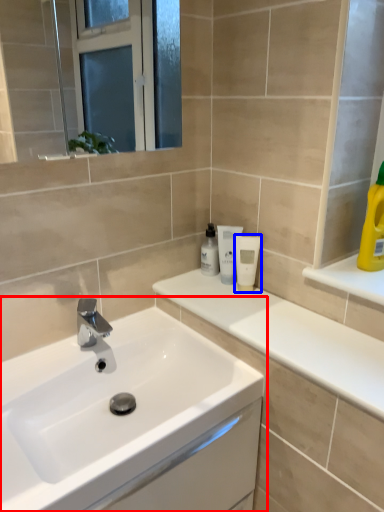
Question: Which point is closer to the camera, sink (highlighted by a red box) or mouthwash (highlighted by a blue box)?

Choices:
 (A) sink
 (B) mouthwash

Answer: (A)